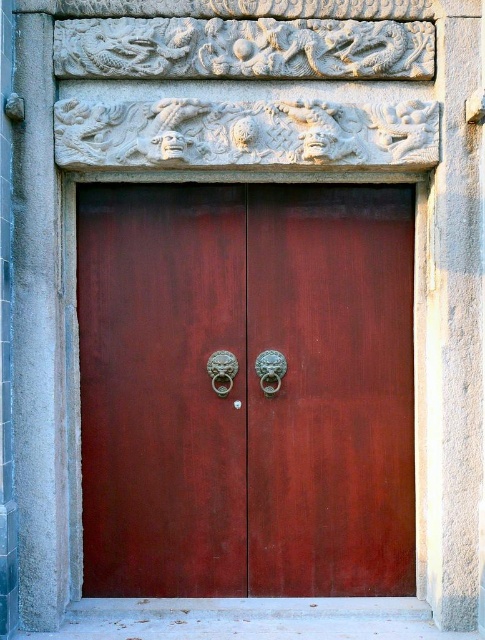
Question: Which point is closer to the camera?

Choices:
 (A) glossy wood door at center
 (B) green metallic lion head at center
 (C) gold metallic lion head at center

Answer: (C)

Question: Which point is farther to the camera?

Choices:
 (A) green metallic lion head at center
 (B) gold metallic lion head at center

Answer: (A)

Question: Among these points, which one is farthest from the camera?

Choices:
 (A) (259, 352)
 (B) (213, 372)
 (C) (263, 358)

Answer: (A)

Question: From the image, what is the correct spatial relationship of glossy wood door at center in relation to green metallic lion head at center?

Choices:
 (A) right
 (B) left

Answer: (B)

Question: From the image, what is the correct spatial relationship of glossy wood door at center in relation to green metallic lion head at center?

Choices:
 (A) below
 (B) above

Answer: (A)

Question: Can you confirm if glossy wood door at center is positioned above gold metallic lion head at center?

Choices:
 (A) yes
 (B) no

Answer: (B)